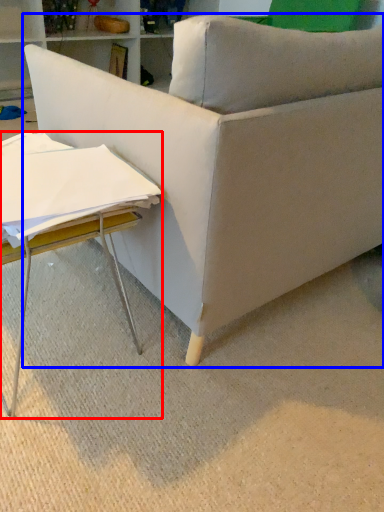
Question: Which object is closer to the camera taking this photo, table (highlighted by a red box) or studio couch (highlighted by a blue box)?

Choices:
 (A) table
 (B) studio couch

Answer: (B)